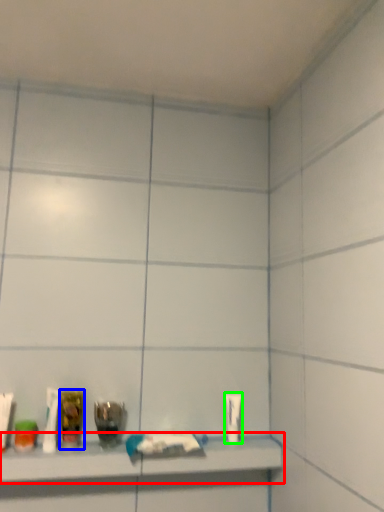
Question: Considering the real-world distances, which object is farthest from shelf (highlighted by a red box)? mouthwash (highlighted by a blue box) or toiletry (highlighted by a green box)?

Choices:
 (A) mouthwash
 (B) toiletry

Answer: (B)